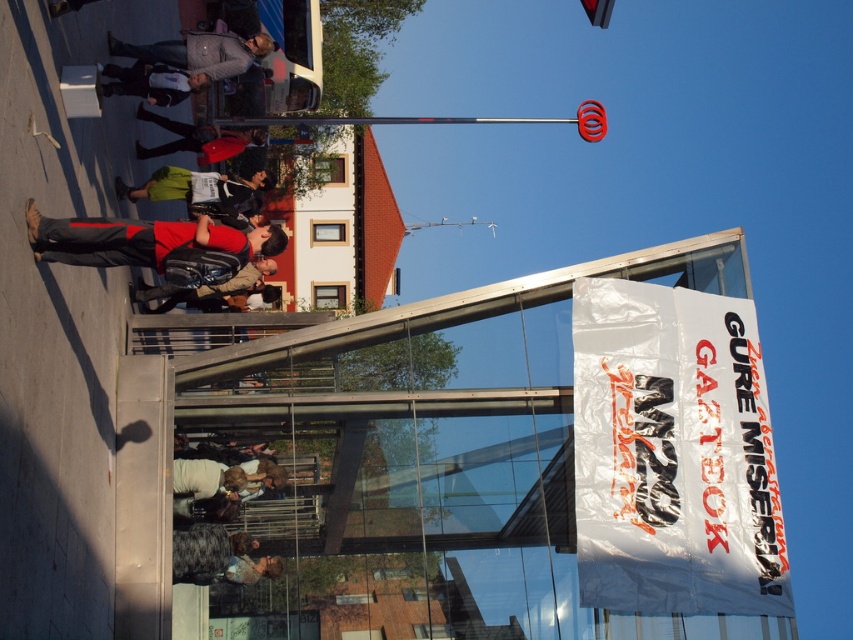
Can you confirm if gray fabric jacket at upper center is positioned below matte black backpack at center?

No, gray fabric jacket at upper center is not below matte black backpack at center.

Does gray fabric jacket at upper center come behind matte black backpack at center?

No, gray fabric jacket at upper center is in front of matte black backpack at center.

You are a GUI agent. You are given a task and a screenshot of the screen. Output one action in this format:
    pyautogui.click(x=<x>, y=<y>)
    Task: Click on the gray fabric jacket at upper center
    This screenshot has height=640, width=853.
    Given the screenshot: What is the action you would take?
    pyautogui.click(x=200, y=52)

Who is more forward, (688, 444) or (99, 218)?

Point (99, 218)

Looking at this image, can you confirm if white crumpled paper banner at upper center is positioned to the right of matte red shirt at center?

Indeed, white crumpled paper banner at upper center is positioned on the right side of matte red shirt at center.

You are a GUI agent. You are given a task and a screenshot of the screen. Output one action in this format:
    pyautogui.click(x=<x>, y=<y>)
    Task: Click on the white crumpled paper banner at upper center
    The width and height of the screenshot is (853, 640).
    Given the screenshot: What is the action you would take?
    pyautogui.click(x=672, y=452)

Where is `white crumpled paper banner at upper center`? white crumpled paper banner at upper center is located at coordinates (672, 452).

Is point (270, 38) more distant than point (248, 182)?

No.

Between gray fabric jacket at upper center and green fabric jacket at center, which one has more height?

With more height is green fabric jacket at center.

Who is more forward, (199, 65) or (136, 192)?

Point (199, 65)

Identify the location of gray fabric jacket at upper center. Image resolution: width=853 pixels, height=640 pixels. (200, 52).